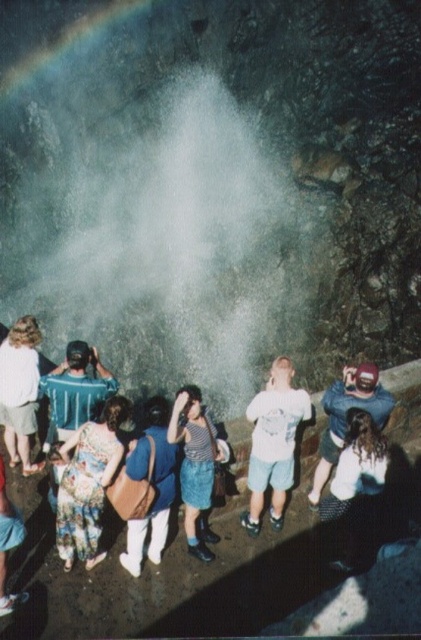
Is the position of white cotton shirt at center less distant than that of blue denim jeans at center?

No.

Is point (269, 444) farther from camera compared to point (322, 401)?

No, (269, 444) is in front of (322, 401).

Which is behind, point (284, 502) or point (325, 394)?

The point (284, 502) is behind.

Image resolution: width=421 pixels, height=640 pixels. I want to click on white cotton shirt at center, so click(274, 442).

In the scene shown: Is floral fabric dress at lower left bigger than blue denim jeans at center?

No.

Does floral fabric dress at lower left have a lesser height compared to blue denim jeans at center?

No, floral fabric dress at lower left is not shorter than blue denim jeans at center.

Measure the distance between point (77, 531) and camera.

6.82 meters

At what (x,y) coordinates should I click in order to perform the action: click on floral fabric dress at lower left. Please return your answer as a coordinate pair (x, y). The height and width of the screenshot is (640, 421). Looking at the image, I should click on (87, 483).

Between floral fabric dress at lower left and matte brown bag at center, which one appears on the left side from the viewer's perspective?

Positioned to the left is floral fabric dress at lower left.

Between point (93, 460) and point (141, 438), which one is positioned in front?

Positioned in front is point (141, 438).

Locate an element on the screen. floral fabric dress at lower left is located at coordinates (87, 483).

I want to click on floral fabric dress at lower left, so click(87, 483).